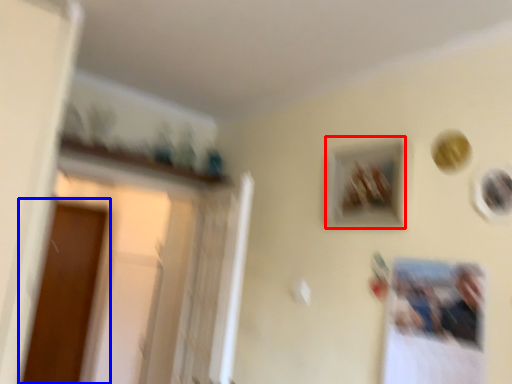
Question: Which object appears farthest to the camera in this image, picture frame (highlighted by a red box) or screen door (highlighted by a blue box)?

Choices:
 (A) picture frame
 (B) screen door

Answer: (B)